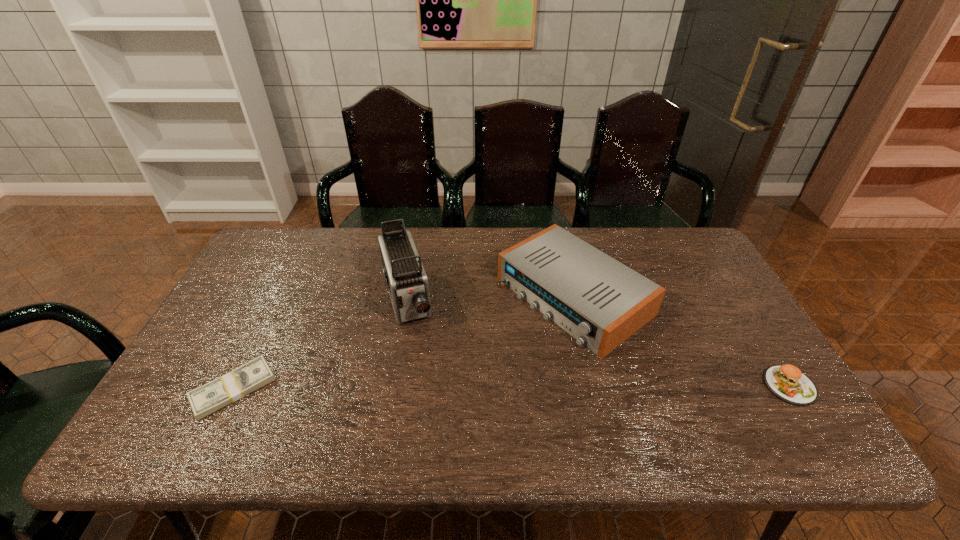
Image resolution: width=960 pixels, height=540 pixels. Find the location of `vacant space located 0.250m on the front panel of the third object from left to right`. vacant space located 0.250m on the front panel of the third object from left to right is located at coordinates (445, 382).

The image size is (960, 540). In order to click on free space located on the front panel of the third object from left to right in this screenshot , I will do `click(486, 356)`.

Locate an element on the screen. Image resolution: width=960 pixels, height=540 pixels. vacant space situated on the front panel of the third object from left to right is located at coordinates (489, 354).

At what (x,y) coordinates should I click in order to perform the action: click on free space located at the lens of the third object from right to left. Please return your answer as a coordinate pair (x, y). Looking at the image, I should click on (429, 395).

Where is `vacant space situated at the lens of the third object from right to left`? This screenshot has height=540, width=960. vacant space situated at the lens of the third object from right to left is located at coordinates (422, 373).

The width and height of the screenshot is (960, 540). I want to click on vacant space located at the lens of the third object from right to left, so click(431, 402).

Identify the location of radio receiver present at the far edge. pyautogui.click(x=601, y=302).

Image resolution: width=960 pixels, height=540 pixels. Find the location of `camcorder that is at the far edge`. camcorder that is at the far edge is located at coordinates (406, 280).

Identify the location of dollar present at the near edge. (204, 400).

I want to click on patty that is positioned at the near edge, so click(787, 382).